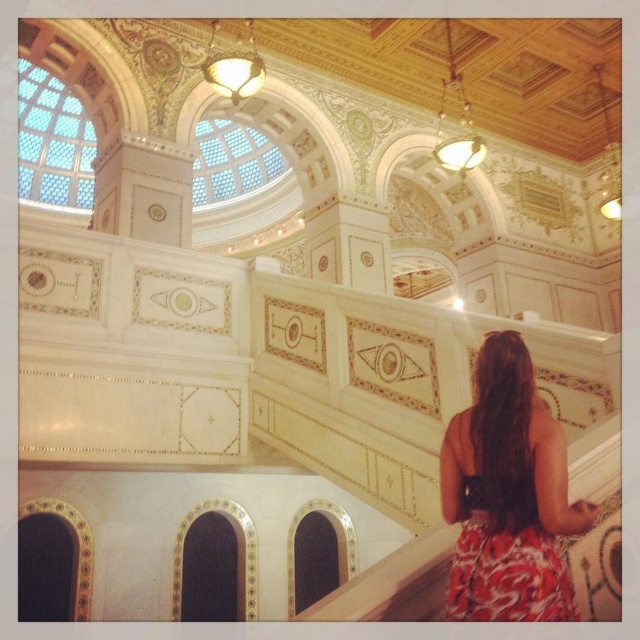
Who is higher up, red floral dress at lower right or printed fabric dress at lower right?

red floral dress at lower right

Between red floral dress at lower right and printed fabric dress at lower right, which one is positioned lower?

printed fabric dress at lower right is lower down.

Where is `red floral dress at lower right`? The height and width of the screenshot is (640, 640). red floral dress at lower right is located at coordinates [508, 496].